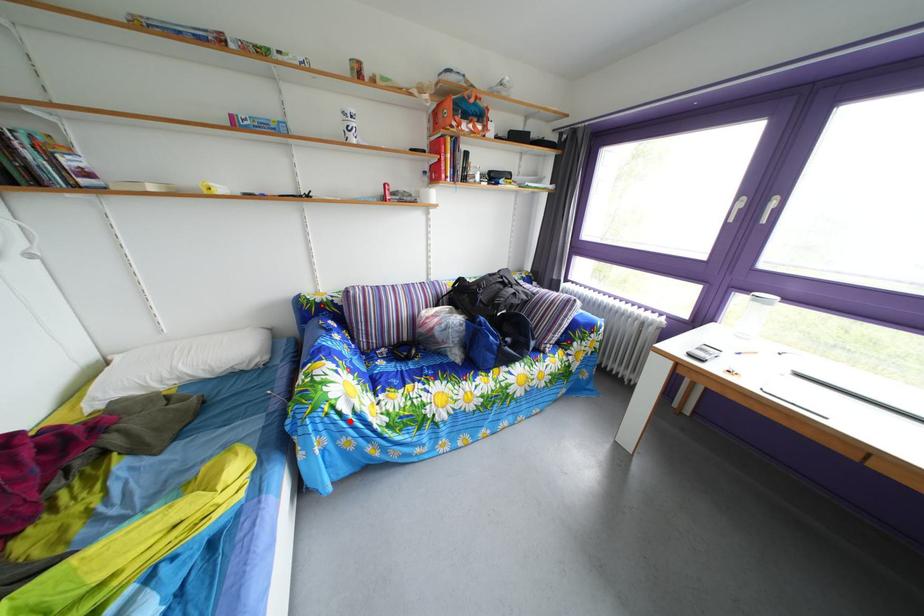
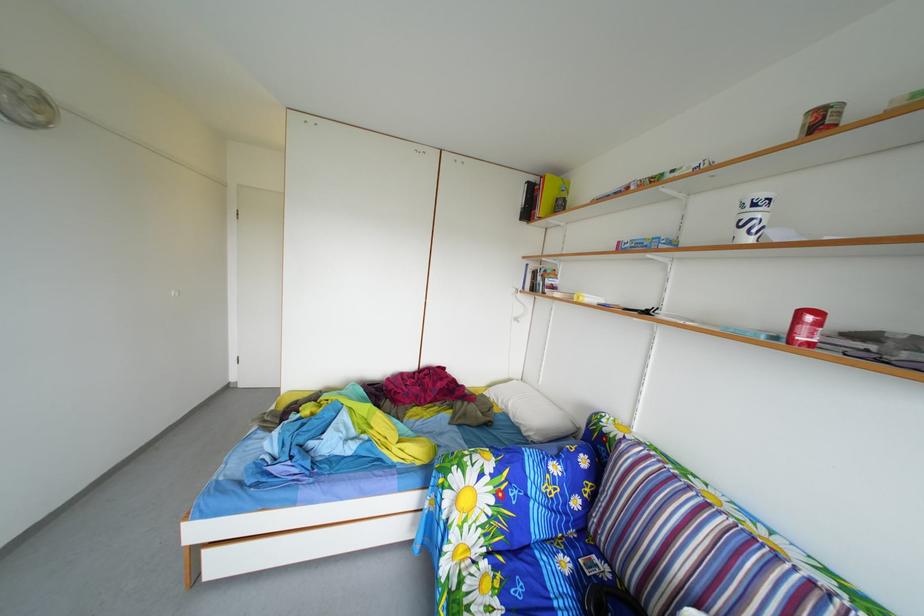
In the second image, find the point that corresponds to the highlighted location in the first image.

(453, 507)